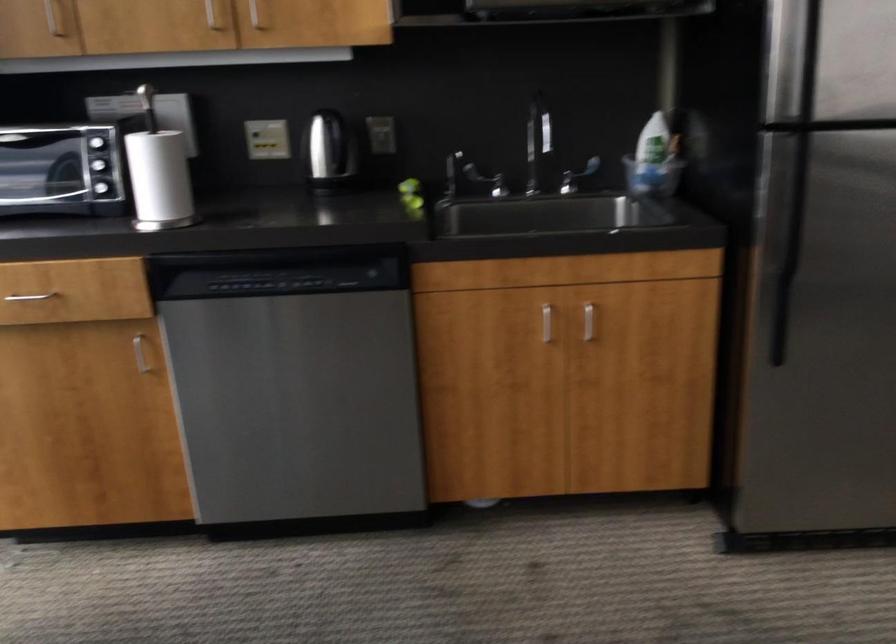
Describe the element at coordinates (576, 176) in the screenshot. I see `the electric kettle handle` at that location.